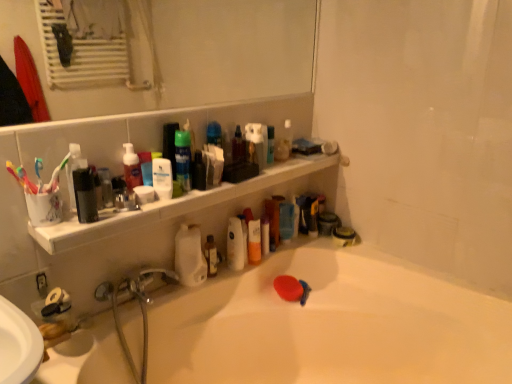
The image size is (512, 384). What do you see at coordinates (170, 206) in the screenshot?
I see `white plastic shelf at upper center` at bounding box center [170, 206].

Identify the location of white matte bottle at center. (190, 256).

I want to click on matte black container at left, acting as the first mouthwash starting from the front, so click(85, 195).

This screenshot has width=512, height=384. In order to click on translucent plastic bottle at upper center, the 2th toiletry in the top-to-bottom sequence in this screenshot , I will do click(x=270, y=144).

At what (x,y) coordinates should I click in order to perform the action: click on white matte lotion at upper center, marked as the third mouthwash in a right-to-left arrangement. Please return your answer as a coordinate pair (x, y). This screenshot has width=512, height=384. Looking at the image, I should click on (162, 178).

I want to click on clear glass mirror at upper center, so click(x=191, y=55).

Is clear glass mirror at upper center taller or shorter than green matte mouthwash at upper center, the fourth mouthwash viewed from the left?

In the image, clear glass mirror at upper center appears to be taller than green matte mouthwash at upper center, the fourth mouthwash viewed from the left.

From the picture: From a real-world perspective, is clear glass mirror at upper center below green matte mouthwash at upper center, the fourth mouthwash viewed from the left?

Actually, clear glass mirror at upper center is physically above green matte mouthwash at upper center, the fourth mouthwash viewed from the left, in the real world.

Starting from the clear glass mirror at upper center, which mouthwash is the 4th one behind? Please provide its 2D coordinates.

[(183, 159)]

Is matte black bottle at upper left, the 2th mouthwash viewed from the left, at the back of white matte bottle at center?

No, white matte bottle at center is not facing away from matte black bottle at upper left, the 2th mouthwash viewed from the left.

How far apart are white matte bottle at center and matte black bottle at upper left, the 2th mouthwash viewed from the left?

15.03 inches.

From a real-world perspective, which object rests below the other?

white matte bottle at center is physically lower.

Is white matte bottle at center outside of matte black bottle at upper left, marked as the second mouthwash in a front-to-back arrangement?

Yes, white matte bottle at center is located beyond the bounds of matte black bottle at upper left, marked as the second mouthwash in a front-to-back arrangement.

Considering their positions, is clear glass mirror at upper center located in front of or behind white plastic shelf at upper center?

clear glass mirror at upper center is positioned closer to the viewer than white plastic shelf at upper center.

Does point (270, 64) appear closer or farther from the camera than point (236, 188)?

Clearly, point (270, 64) is more distant from the camera than point (236, 188).

How different are the orientations of clear glass mirror at upper center and white plastic shelf at upper center in degrees?

0.225 degrees separate the facing orientations of clear glass mirror at upper center and white plastic shelf at upper center.

Can we say clear glass mirror at upper center lies outside white plastic shelf at upper center?

Yes, clear glass mirror at upper center is outside of white plastic shelf at upper center.

From the image's perspective, would you say translucent plastic spray bottle at upper center, which is the second toiletry in right-to-left order, is positioned over matte black container at left, which is the fifth mouthwash in right-to-left order?

Yes.

Considering the sizes of objects translucent plastic spray bottle at upper center, which is the second toiletry in right-to-left order, and matte black container at left, which is the fifth mouthwash in right-to-left order, in the image provided, who is smaller, translucent plastic spray bottle at upper center, which is the second toiletry in right-to-left order, or matte black container at left, which is the fifth mouthwash in right-to-left order,?

With smaller size is translucent plastic spray bottle at upper center, which is the second toiletry in right-to-left order.

From a real-world perspective, which object rests below the other?

From a 3D spatial view, matte black container at left, which is the fifth mouthwash in right-to-left order, is below.

From the image's perspective, is clear glass mirror at upper center above or below translucent plastic spray bottle at upper center, acting as the first toiletry starting from the top?

Based on their image positions, clear glass mirror at upper center is located above translucent plastic spray bottle at upper center, acting as the first toiletry starting from the top.

Find the location of a particular element. mirror in front of the translucent plastic spray bottle at upper center, which appears as the 3th toiletry when viewed from the left is located at coordinates click(x=191, y=55).

Looking at this image, would you say clear glass mirror at upper center contains translucent plastic spray bottle at upper center, the 3th toiletry positioned from the front?

No, translucent plastic spray bottle at upper center, the 3th toiletry positioned from the front, is not surrounded by clear glass mirror at upper center.

Is point (173, 101) closer or farther from the camera than point (290, 146)?

Point (173, 101).

Which is more to the right, matte black soap at lower right, arranged as the fourth toiletry when viewed from the front, or white plastic toothbrush at left, the 1th toothbrush in the right-to-left sequence?

Positioned to the right is matte black soap at lower right, arranged as the fourth toiletry when viewed from the front.

Which object is closer to the camera taking this photo, matte black soap at lower right, the first toiletry in the back-to-front sequence, or white plastic toothbrush at left, the 1th toothbrush in the right-to-left sequence?

white plastic toothbrush at left, the 1th toothbrush in the right-to-left sequence, is more forward.

Identify the location of the 1st toothbrush located above the matte black soap at lower right, which appears as the 1th toiletry when ordered from the bottom (from a real-world perspective). (56, 176).

From the image's perspective, which is above, matte black soap at lower right, which is counted as the first toiletry, starting from the right, or white plastic toothbrush at left, which appears as the second toothbrush when viewed from the left?

From the image's view, white plastic toothbrush at left, which appears as the second toothbrush when viewed from the left, is above.

From a real-world perspective, is white matte bottle at center above or below brown glass bottle at center, acting as the first mouthwash starting from the back?

In terms of real-world spatial position, white matte bottle at center is above brown glass bottle at center, acting as the first mouthwash starting from the back.

How many degrees apart are the facing directions of white matte bottle at center and brown glass bottle at center, which appears as the 1th mouthwash when viewed from the right?

white matte bottle at center and brown glass bottle at center, which appears as the 1th mouthwash when viewed from the right, are facing 5.24e-05 degrees away from each other.

Is point (191, 270) closer or farther from the camera than point (209, 236)?

Point (191, 270) appears to be closer to the viewer than point (209, 236).

Where is `mirror in front of the green matte mouthwash at upper center, the fourth mouthwash viewed from the left`? This screenshot has width=512, height=384. mirror in front of the green matte mouthwash at upper center, the fourth mouthwash viewed from the left is located at coordinates point(191,55).

Image resolution: width=512 pixels, height=384 pixels. What are the coordinates of `cleaning product below the matte black bottle at upper left, the 2th mouthwash viewed from the left (from the image's perspective)` in the screenshot? It's located at (190, 256).

Estimate the real-world distances between objects in this image. Which object is closer to translucent plastic spray bottle at upper center, acting as the first toiletry starting from the top, white plastic shelf at upper center or white plastic toothbrush at left, the 1th toothbrush in the right-to-left sequence?

Among the two, white plastic shelf at upper center is located nearer to translucent plastic spray bottle at upper center, acting as the first toiletry starting from the top.

Based on their spatial positions, is matte black bottle at upper left, marked as the second mouthwash in a front-to-back arrangement, or translucent plastic spray bottle at upper center, the first toiletry when ordered from left to right, further from brown glass bottle at center, which appears as the 1th mouthwash when viewed from the right?

matte black bottle at upper left, marked as the second mouthwash in a front-to-back arrangement.

When comparing their distances from translucent plastic spray bottle at upper center, which appears as the 3th toiletry when viewed from the left, does matte black soap at lower right, which is counted as the first toiletry, starting from the right, or white plastic shelf at upper center seem closer?

white plastic shelf at upper center lies closer to translucent plastic spray bottle at upper center, which appears as the 3th toiletry when viewed from the left, than the other object.

When comparing their distances from clear glass mirror at upper center, does matte black soap at lower right, positioned as the 4th toiletry in left-to-right order, or white plastic toothbrush at left, which appears as the second toothbrush when viewed from the left, seem closer?

The object closer to clear glass mirror at upper center is matte black soap at lower right, positioned as the 4th toiletry in left-to-right order.

Estimate the real-world distances between objects in this image. Which object is closer to white glossy bathtub at lower center, green matte mouthwash at upper center, the fourth mouthwash viewed from the left, or brown glass bottle at center, which appears as the 1th mouthwash when viewed from the right?

brown glass bottle at center, which appears as the 1th mouthwash when viewed from the right, lies closer to white glossy bathtub at lower center than the other object.

Considering their positions, is white matte bottle at center positioned closer to green matte mouthwash at upper center, which ranks as the fourth mouthwash in front-to-back order, than multicolored plastic toothbrush at left, placed as the 1th toothbrush when sorted from left to right?

white matte bottle at center.

When comparing their distances from translucent plastic spray bottle at upper center, which is the second toiletry in right-to-left order, does white matte lotion at upper center, the 3th mouthwash from the front, or white plastic toothbrush at left, which appears as the second toothbrush when viewed from the left, seem closer?

white matte lotion at upper center, the 3th mouthwash from the front, is positioned closer to the anchor translucent plastic spray bottle at upper center, which is the second toiletry in right-to-left order.

Looking at the image, which one is located closer to translucent plastic spray bottle at upper center, the 3th toiletry positioned from the front, matte black container at left, which is the fifth mouthwash in right-to-left order, or white matte bottle at center?

white matte bottle at center is closer to translucent plastic spray bottle at upper center, the 3th toiletry positioned from the front.

Image resolution: width=512 pixels, height=384 pixels. What are the coordinates of `toothbrush located between multicolored plastic toothbrush at left, placed as the 1th toothbrush when sorted from left to right, and matte black container at left, which appears as the 5th mouthwash when viewed from the back, in the left-right direction` in the screenshot? It's located at (56, 176).

This screenshot has width=512, height=384. What are the coordinates of `toothbrush between multicolored plastic toothbrush at left, positioned as the 2th toothbrush in right-to-left order, and translucent plastic spray bottle at upper center, which is counted as the second toiletry, starting from the bottom, in the front-back direction` in the screenshot? It's located at (56, 176).

I want to click on toothbrush between clear glass mirror at upper center and multicolored plastic toothbrush at left, positioned as the 2th toothbrush in right-to-left order, in the up-down direction, so click(56, 176).

Image resolution: width=512 pixels, height=384 pixels. Find the location of `cleaning product between matte black bottle at upper left, the 2th mouthwash viewed from the left, and brown glass bottle at center, the 5th mouthwash in the front-to-back sequence, from front to back`. cleaning product between matte black bottle at upper left, the 2th mouthwash viewed from the left, and brown glass bottle at center, the 5th mouthwash in the front-to-back sequence, from front to back is located at coordinates (190, 256).